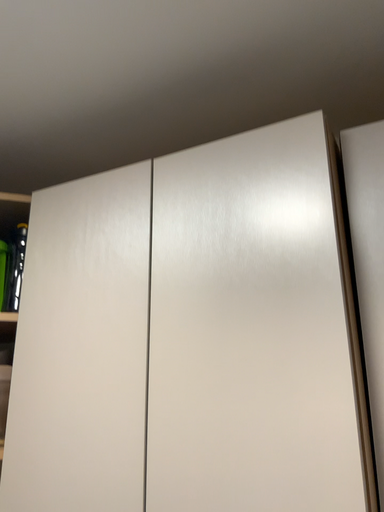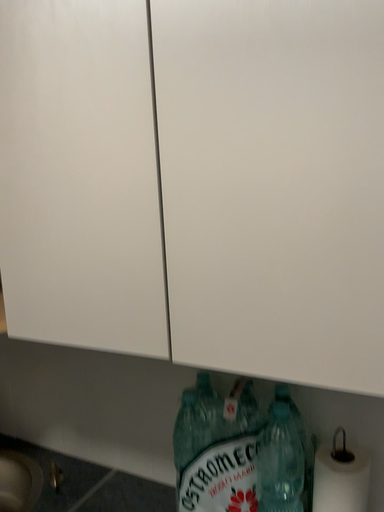
Question: How did the camera likely rotate when shooting the video?

Choices:
 (A) rotated downward
 (B) rotated upward

Answer: (A)